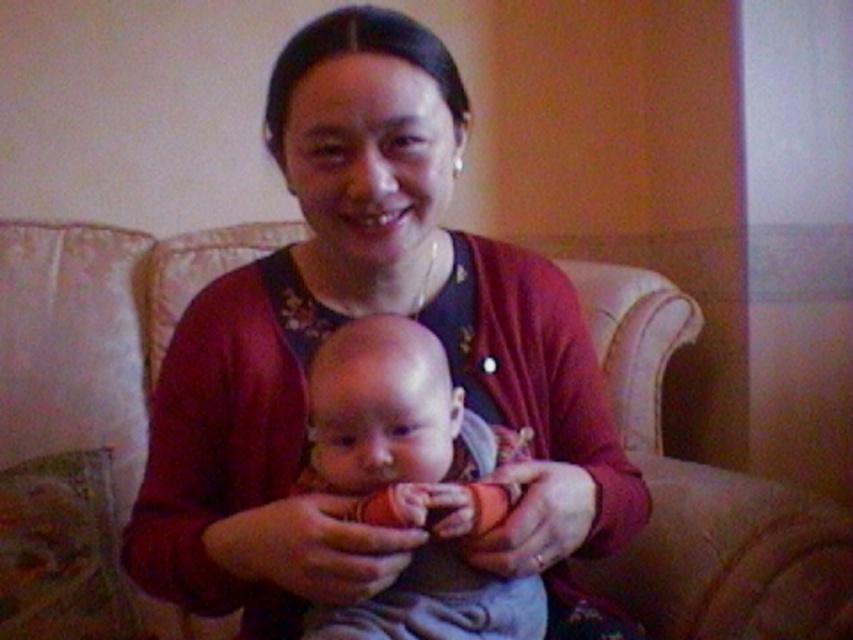
You are a photographer setting up a shoot in this room. You want to ensure the matte red cardigan at center is visible without being blocked by the beige fabric couch at center. Based on the scene, is the current arrangement suitable?

The matte red cardigan at center is in front of the beige fabric couch at center, so it is not blocked and the current arrangement is suitable.

You are a photographer adjusting the focus on your camera. You want to capture both the matte red cardigan at center and the smooth skin baby at center clearly. Which object should you focus on first to ensure the closest one is sharp?

The matte red cardigan at center is closer to the viewer than the smooth skin baby at center, so you should focus on the matte red cardigan at center first to ensure the closest object is sharp.

You are a photographer setting up for a family photo. You need to ensure the smooth skin baby at center is visible in the shot. Given that the beige fabric couch at center is between the camera and the baby, how should you adjust your position?

The smooth skin baby at center is behind the beige fabric couch at center, so you should move the camera closer to the baby or adjust the angle so that the couch doesn not block the view.